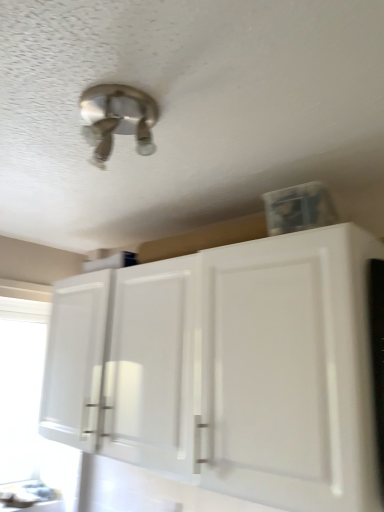
Question: Is satin nickel light fixture at upper center to the left of transparent plastic window screen at left from the viewer's perspective?

Choices:
 (A) yes
 (B) no

Answer: (B)

Question: Is satin nickel light fixture at upper center thinner than transparent plastic window screen at left?

Choices:
 (A) no
 (B) yes

Answer: (A)

Question: From a real-world perspective, is satin nickel light fixture at upper center physically above transparent plastic window screen at left?

Choices:
 (A) yes
 (B) no

Answer: (A)

Question: Is the position of satin nickel light fixture at upper center less distant than that of transparent plastic window screen at left?

Choices:
 (A) no
 (B) yes

Answer: (B)

Question: Is satin nickel light fixture at upper center turned away from transparent plastic window screen at left?

Choices:
 (A) yes
 (B) no

Answer: (B)

Question: Is the surface of satin nickel light fixture at upper center in direct contact with transparent plastic window screen at left?

Choices:
 (A) no
 (B) yes

Answer: (A)

Question: Is transparent plastic window screen at left bigger than satin nickel light fixture at upper center?

Choices:
 (A) yes
 (B) no

Answer: (A)

Question: Considering the relative positions of transparent plastic window screen at left and satin nickel light fixture at upper center in the image provided, is transparent plastic window screen at left in front of satin nickel light fixture at upper center?

Choices:
 (A) yes
 (B) no

Answer: (B)

Question: Is transparent plastic window screen at left to the right of satin nickel light fixture at upper center from the viewer's perspective?

Choices:
 (A) yes
 (B) no

Answer: (B)

Question: From the image's perspective, is transparent plastic window screen at left located above satin nickel light fixture at upper center?

Choices:
 (A) yes
 (B) no

Answer: (B)

Question: Could satin nickel light fixture at upper center be considered to be inside transparent plastic window screen at left?

Choices:
 (A) yes
 (B) no

Answer: (B)

Question: From a real-world perspective, is transparent plastic window screen at left on top of satin nickel light fixture at upper center?

Choices:
 (A) no
 (B) yes

Answer: (A)

Question: Is the depth of white glossy cabinet at lower right less than that of transparent plastic window screen at left?

Choices:
 (A) yes
 (B) no

Answer: (A)